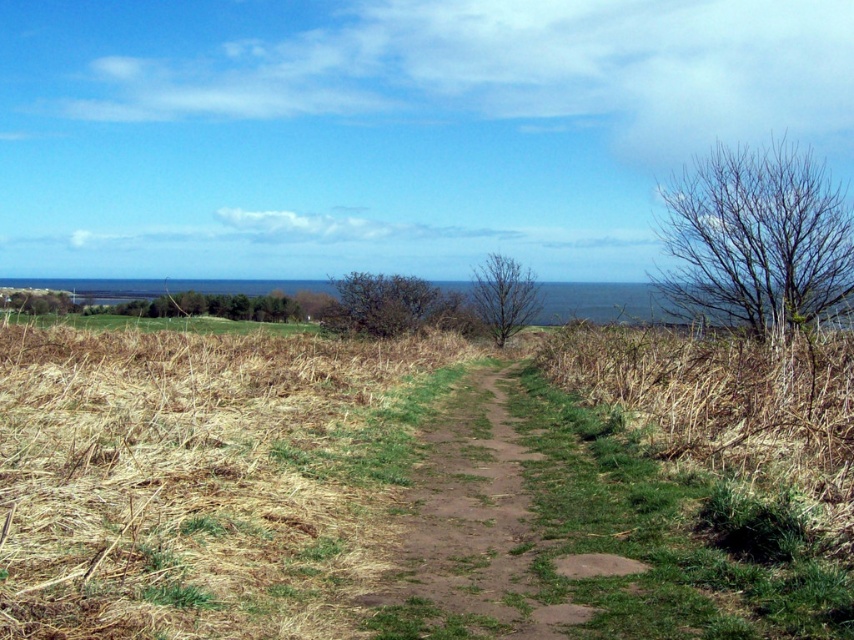
Who is taller, dirt path at center or green leafy tree at upper left?

Standing taller between the two is green leafy tree at upper left.

Which is behind, point (512, 632) or point (63, 310)?

Point (63, 310)

Locate an element on the screen. dirt path at center is located at coordinates (483, 525).

I want to click on dirt path at center, so click(x=483, y=525).

Which is more to the right, brown textured bush at center or bare branches at center?

From the viewer's perspective, bare branches at center appears more on the right side.

Is point (370, 301) positioned in front of point (518, 323)?

Yes.

Which is in front, point (382, 324) or point (519, 285)?

Positioned in front is point (382, 324).

You are a GUI agent. You are given a task and a screenshot of the screen. Output one action in this format:
    pyautogui.click(x=<x>, y=<y>)
    Task: Click on the brown textured bush at center
    This screenshot has height=640, width=854.
    Given the screenshot: What is the action you would take?
    pyautogui.click(x=379, y=304)

Who is positioned more to the left, dirt path at center or bare branches at center?

From the viewer's perspective, dirt path at center appears more on the left side.

Does dirt path at center have a lesser height compared to bare branches at center?

Yes.

Does point (490, 445) lie in front of point (518, 298)?

Yes, it is in front of point (518, 298).

Where is `dirt path at center`? dirt path at center is located at coordinates pyautogui.click(x=483, y=525).